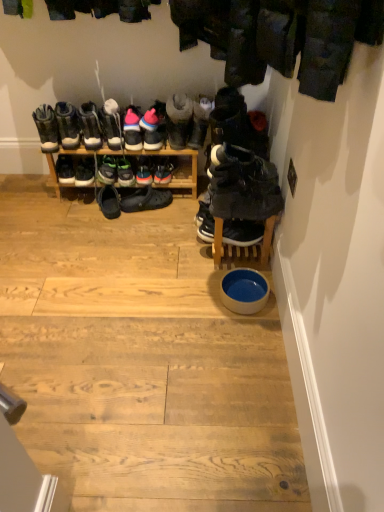
Question: Is black rubber shoes at center, which is counted as the ninth footwear, starting from the right, taller than green suede sneakers at center, acting as the 6th footwear starting from the left?

Choices:
 (A) no
 (B) yes

Answer: (B)

Question: From a real-world perspective, is black rubber shoes at center, which ranks as the 8th footwear in left-to-right order, over green suede sneakers at center, the eleventh footwear viewed from the right?

Choices:
 (A) yes
 (B) no

Answer: (B)

Question: Is black rubber shoes at center, which ranks as the 8th footwear in left-to-right order, positioned before green suede sneakers at center, acting as the 6th footwear starting from the left?

Choices:
 (A) yes
 (B) no

Answer: (B)

Question: Does black rubber shoes at center, which is counted as the ninth footwear, starting from the right, have a lesser height compared to green suede sneakers at center, acting as the 6th footwear starting from the left?

Choices:
 (A) no
 (B) yes

Answer: (A)

Question: Can we say black rubber shoes at center, which ranks as the 8th footwear in left-to-right order, lies outside green suede sneakers at center, the eleventh footwear viewed from the right?

Choices:
 (A) yes
 (B) no

Answer: (A)

Question: From a real-world perspective, is leather boots at left, which ranks as the second footwear in left-to-right order, positioned above or below black suede sneakers at center, which is the sixteenth footwear in left-to-right order?

Choices:
 (A) below
 (B) above

Answer: (B)

Question: Based on their sizes in the image, would you say leather boots at left, the 15th footwear in the right-to-left sequence, is bigger or smaller than black suede sneakers at center, which is the sixteenth footwear in left-to-right order?

Choices:
 (A) small
 (B) big

Answer: (A)

Question: Is leather boots at left, the 15th footwear in the right-to-left sequence, inside or outside of black suede sneakers at center, which is the 1th footwear in right-to-left order?

Choices:
 (A) outside
 (B) inside

Answer: (A)

Question: Relative to black suede sneakers at center, which is the 1th footwear in right-to-left order, is leather boots at left, the 15th footwear in the right-to-left sequence, in front or behind?

Choices:
 (A) behind
 (B) front

Answer: (A)

Question: Would you say shiny blue sneakers at center, which is counted as the ninth footwear, starting from the left, is to the left or to the right of matte black boots at center, positioned as the third footwear in left-to-right order, in the picture?

Choices:
 (A) left
 (B) right

Answer: (B)

Question: From a real-world perspective, is shiny blue sneakers at center, which is counted as the 8th footwear, starting from the right, physically located above or below matte black boots at center, which ranks as the 14th footwear in right-to-left order?

Choices:
 (A) above
 (B) below

Answer: (B)

Question: Considering the positions of point (147, 163) and point (84, 115), is point (147, 163) closer or farther from the camera than point (84, 115)?

Choices:
 (A) closer
 (B) farther

Answer: (B)

Question: Is shiny blue sneakers at center, which is counted as the 8th footwear, starting from the right, in front of or behind matte black boots at center, positioned as the third footwear in left-to-right order, in the image?

Choices:
 (A) behind
 (B) front

Answer: (A)

Question: From a real-world perspective, is pink suede sneakers at center, the 6th footwear from the right, positioned above or below black suede sneakers at center, which is the fifteenth footwear from left to right?

Choices:
 (A) below
 (B) above

Answer: (A)

Question: In terms of width, does pink suede sneakers at center, the 6th footwear from the right, look wider or thinner when compared to black suede sneakers at center, arranged as the second footwear when viewed from the right?

Choices:
 (A) thin
 (B) wide

Answer: (A)